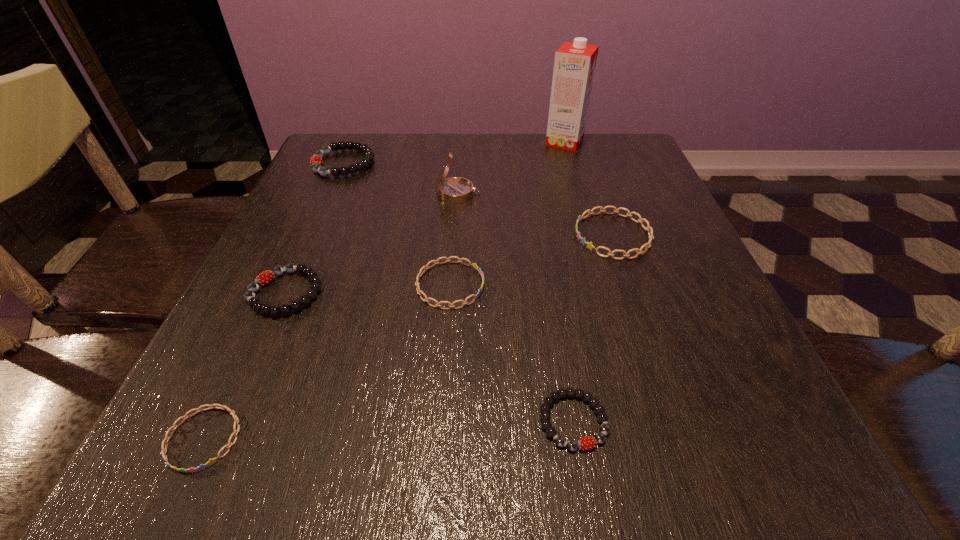
Where is `vacant area that lies between the biggest blue bracelet and the second farthest black bracelet`? The height and width of the screenshot is (540, 960). vacant area that lies between the biggest blue bracelet and the second farthest black bracelet is located at coordinates (449, 264).

This screenshot has height=540, width=960. Find the location of `free area in between the tallest object and the fifth nearest object`. free area in between the tallest object and the fifth nearest object is located at coordinates (588, 188).

Find the location of a particular element. The width and height of the screenshot is (960, 540). empty location between the third farthest object and the tallest bracelet is located at coordinates (401, 178).

You are a GUI agent. You are given a task and a screenshot of the screen. Output one action in this format:
    pyautogui.click(x=<x>, y=<y>)
    Task: Click on the free spot between the third farthest object and the farthest black bracelet
    Image resolution: width=960 pixels, height=540 pixels.
    Given the screenshot: What is the action you would take?
    pyautogui.click(x=401, y=178)

The height and width of the screenshot is (540, 960). I want to click on vacant space that's between the fifth bracelet from left to right and the fourth bracelet from left to right, so click(x=512, y=353).

Where is `vacant space that's between the second nearest blue bracelet and the fifth bracelet from left to right`? vacant space that's between the second nearest blue bracelet and the fifth bracelet from left to right is located at coordinates (512, 353).

This screenshot has width=960, height=540. I want to click on free space that is in between the second biggest black bracelet and the fifth bracelet from left to right, so click(429, 357).

Find the location of `object that is the third closest to the smallest black bracelet`. object that is the third closest to the smallest black bracelet is located at coordinates (266, 277).

Choose which object is the fourth nearest neighbor to the farthest bracelet. Please provide its 2D coordinates. Your answer should be formatted as a tuple, i.e. [(x, y)], where the tuple contains the x and y coordinates of a point satisfying the conditions above.

[(574, 66)]

Find the location of `bracelet object that ranks as the fourth closest to the second farthest blue bracelet`. bracelet object that ranks as the fourth closest to the second farthest blue bracelet is located at coordinates (166, 439).